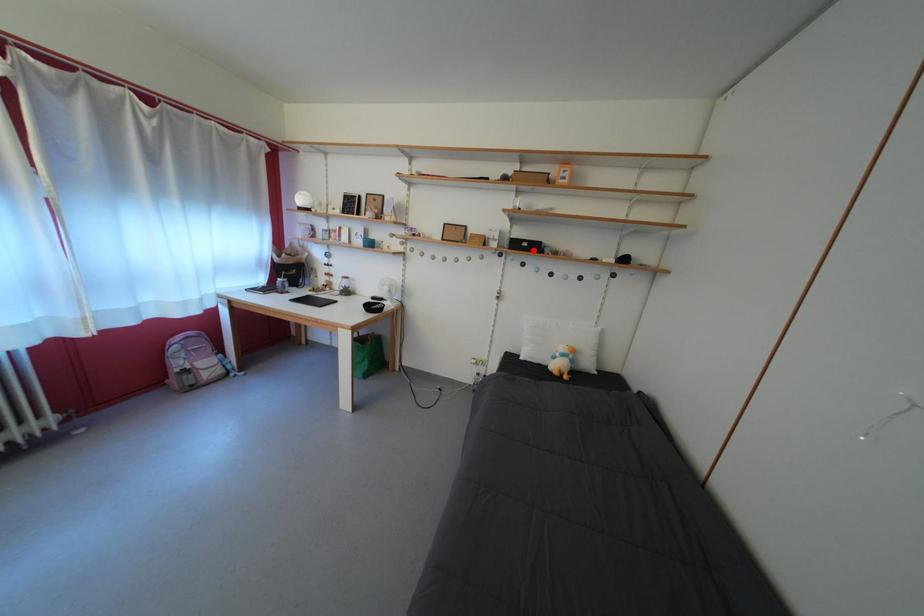
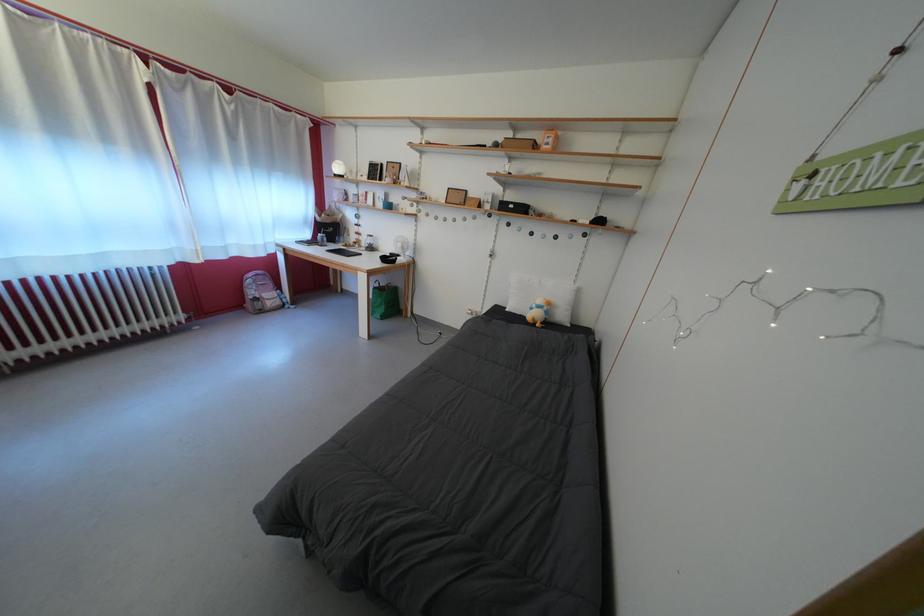
In the second image, find the point that corresponds to the highlighted location in the first image.

(519, 213)